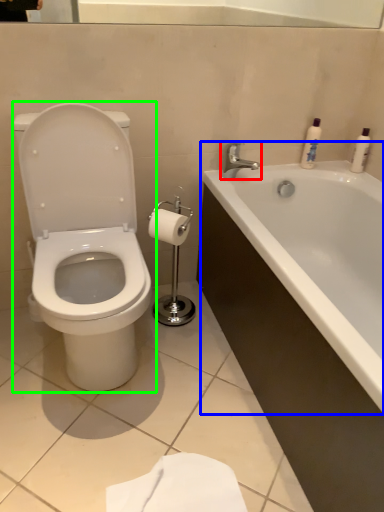
Question: Estimate the real-world distances between objects in this image. Which object is closer to tap (highlighted by a red box), bathtub (highlighted by a blue box) or toilet (highlighted by a green box)?

Choices:
 (A) bathtub
 (B) toilet

Answer: (A)